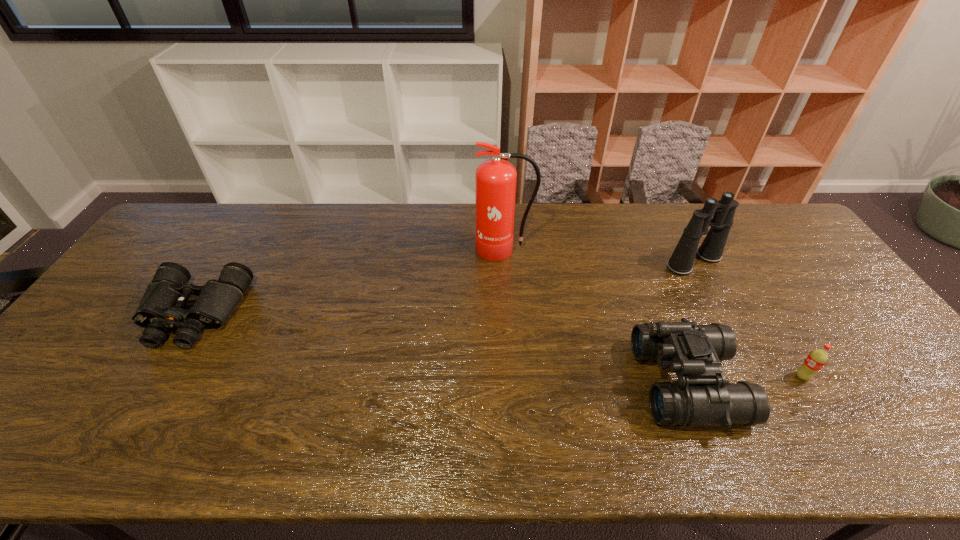
Where is `free space located on the front of the second tallest object`? The height and width of the screenshot is (540, 960). free space located on the front of the second tallest object is located at coordinates (732, 336).

Identify the location of vacant area located 0.360m through the lenses of the second shortest binoculars. pyautogui.click(x=492, y=383).

Identify the location of vacant region located 0.370m through the lenses of the second shortest binoculars. This screenshot has width=960, height=540. (488, 383).

Locate an element on the screen. The height and width of the screenshot is (540, 960). free spot located through the lenses of the second shortest binoculars is located at coordinates (525, 383).

I want to click on vacant space located on the left of the fourth tallest object, so click(x=713, y=376).

Find the location of `free space located 0.230m through the eyepieces of the leftmost binoculars`. free space located 0.230m through the eyepieces of the leftmost binoculars is located at coordinates (120, 435).

I want to click on object that is positioned at the far edge, so tap(495, 179).

Find the location of a particular element. The width and height of the screenshot is (960, 540). object that is at the near edge is located at coordinates (702, 396).

You are a GUI agent. You are given a task and a screenshot of the screen. Output one action in this format:
    pyautogui.click(x=<x>, y=<y>)
    Task: Click on the object that is positioned at the left edge
    This screenshot has width=960, height=540.
    Given the screenshot: What is the action you would take?
    pyautogui.click(x=161, y=308)

At what (x,y) coordinates should I click in order to perform the action: click on blank area at the far edge. Please return your answer as a coordinate pair (x, y). This screenshot has width=960, height=540. Looking at the image, I should click on (282, 221).